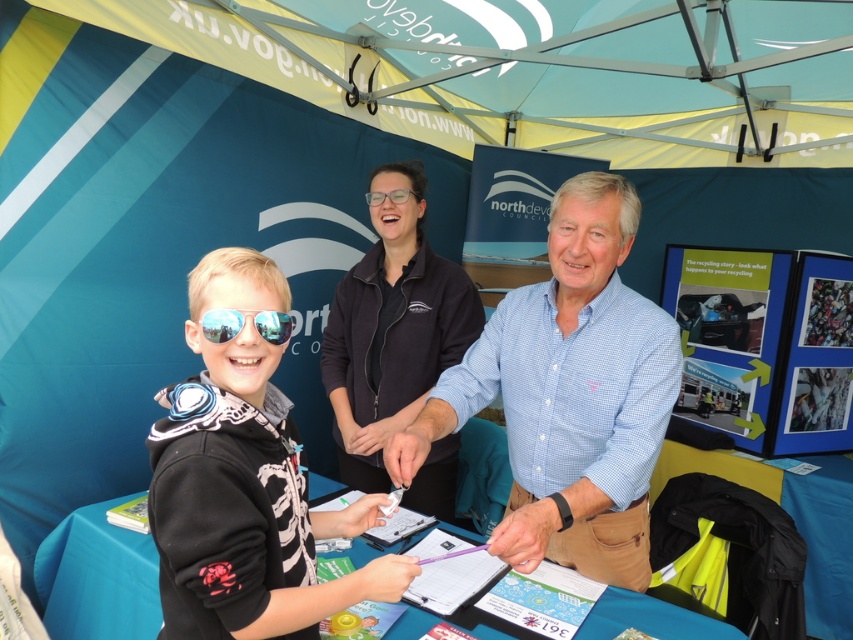
Question: Which of these objects is positioned closest to the blue fabric table at center?

Choices:
 (A) blue checkered shirt at center
 (B) black matte hoodie at center

Answer: (B)

Question: Considering the real-world distances, which object is farthest from the blue fabric table at center?

Choices:
 (A) light blue checkered shirt at center
 (B) black matte hoodie at center
 (C) reflective plastic goggles at center

Answer: (C)

Question: Can you confirm if blue checkered shirt at center is wider than reflective plastic goggles at center?

Choices:
 (A) yes
 (B) no

Answer: (A)

Question: Where is light blue checkered shirt at center located in relation to blue fabric table at center in the image?

Choices:
 (A) below
 (B) above

Answer: (B)

Question: Considering the relative positions of blue fabric table at center and reflective plastic goggles at center in the image provided, where is blue fabric table at center located with respect to reflective plastic goggles at center?

Choices:
 (A) below
 (B) above

Answer: (A)

Question: Which point is farther from the camera taking this photo?

Choices:
 (A) (207, 412)
 (B) (546, 442)
 (C) (679, 612)
 (D) (469, 340)

Answer: (D)